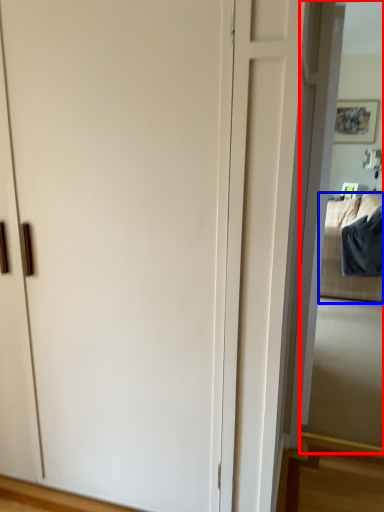
Question: Which point is further to the camera, mirror (highlighted by a red box) or bedding (highlighted by a blue box)?

Choices:
 (A) mirror
 (B) bedding

Answer: (B)